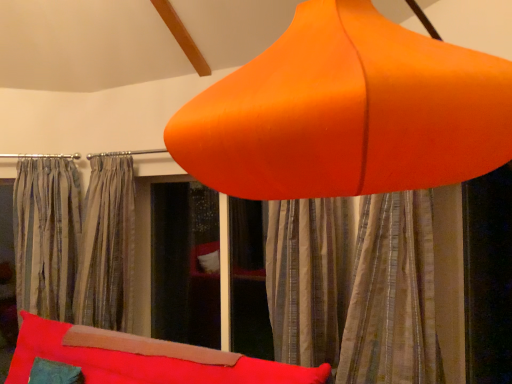
What do you see at coordinates (347, 112) in the screenshot? I see `orange matte lampshade at upper center` at bounding box center [347, 112].

What is the approximate width of striped fabric curtain at center, which ranks as the 1th curtain in front-to-back order?

striped fabric curtain at center, which ranks as the 1th curtain in front-to-back order, is 17.40 inches in width.

Measure the distance between striped fabric curtain at center, the 1th curtain viewed from the right, and camera.

striped fabric curtain at center, the 1th curtain viewed from the right, is 1.77 meters away from camera.

What is the approximate width of velvet red bean bag at lower center?

velvet red bean bag at lower center is 32.22 inches in width.

This screenshot has height=384, width=512. What do you see at coordinates (106, 245) in the screenshot? I see `silky gray curtains at center, which is counted as the second curtain, starting from the front` at bounding box center [106, 245].

At what (x,y) coordinates should I click in order to perform the action: click on orange matte lampshade at upper center. Please return your answer as a coordinate pair (x, y). The width and height of the screenshot is (512, 384). Looking at the image, I should click on (347, 112).

Relative to velvet red bean bag at lower center, is silky gray curtains at center, the 1th curtain in the left-to-right sequence, in front or behind?

Visually, silky gray curtains at center, the 1th curtain in the left-to-right sequence, is located behind velvet red bean bag at lower center.

Does silky gray curtains at center, placed as the 1th curtain when sorted from back to front, have a greater height compared to velvet red bean bag at lower center?

Yes, silky gray curtains at center, placed as the 1th curtain when sorted from back to front, is taller than velvet red bean bag at lower center.

Choose the correct answer: Is orange matte lampshade at upper center inside striped fabric curtain at center, which ranks as the 1th curtain in front-to-back order, or outside it?

orange matte lampshade at upper center cannot be found inside striped fabric curtain at center, which ranks as the 1th curtain in front-to-back order.

Measure the distance from orange matte lampshade at upper center to striped fabric curtain at center, the 1th curtain viewed from the right.

The distance of orange matte lampshade at upper center from striped fabric curtain at center, the 1th curtain viewed from the right, is 1.35 meters.

Is orange matte lampshade at upper center looking in the opposite direction of striped fabric curtain at center, which ranks as the 1th curtain in front-to-back order?

No.

From the image's perspective, which one is positioned lower, orange matte lampshade at upper center or striped fabric curtain at center, which ranks as the 1th curtain in front-to-back order?

striped fabric curtain at center, which ranks as the 1th curtain in front-to-back order, appears lower in the image.

Is point (453, 217) closer to viewer compared to point (125, 336)?

That is True.

Considering the sizes of objects striped fabric curtain at center, marked as the 2th curtain in a back-to-front arrangement, and velvet red bean bag at lower center in the image provided, who is taller, striped fabric curtain at center, marked as the 2th curtain in a back-to-front arrangement, or velvet red bean bag at lower center?

striped fabric curtain at center, marked as the 2th curtain in a back-to-front arrangement.

From the image's perspective, which object appears higher, striped fabric curtain at center, which ranks as the 1th curtain in front-to-back order, or velvet red bean bag at lower center?

striped fabric curtain at center, which ranks as the 1th curtain in front-to-back order, appears higher in the image.

Does striped fabric curtain at center, marked as the 2th curtain in a back-to-front arrangement, have a smaller size compared to velvet red bean bag at lower center?

Correct, striped fabric curtain at center, marked as the 2th curtain in a back-to-front arrangement, occupies less space than velvet red bean bag at lower center.

Considering the relative sizes of velvet red bean bag at lower center and silky gray curtains at center, which is counted as the second curtain, starting from the front, in the image provided, is velvet red bean bag at lower center smaller than silky gray curtains at center, which is counted as the second curtain, starting from the front,?

No, velvet red bean bag at lower center is not smaller than silky gray curtains at center, which is counted as the second curtain, starting from the front.

Is velvet red bean bag at lower center inside the boundaries of silky gray curtains at center, the second curtain when ordered from right to left, or outside?

velvet red bean bag at lower center is spatially situated outside silky gray curtains at center, the second curtain when ordered from right to left.

From the image's perspective, which one is positioned lower, velvet red bean bag at lower center or silky gray curtains at center, the second curtain when ordered from right to left?

velvet red bean bag at lower center is shown below in the image.

Is velvet red bean bag at lower center taller than silky gray curtains at center, the 1th curtain in the left-to-right sequence?

No.

Based on the photo, is striped fabric curtain at center, which ranks as the 1th curtain in front-to-back order, turned away from orange matte lampshade at upper center?

No.

Considering the sizes of striped fabric curtain at center, the second curtain viewed from the left, and orange matte lampshade at upper center in the image, is striped fabric curtain at center, the second curtain viewed from the left, taller or shorter than orange matte lampshade at upper center?

Considering their sizes, striped fabric curtain at center, the second curtain viewed from the left, has less height than orange matte lampshade at upper center.

Would you say orange matte lampshade at upper center is part of striped fabric curtain at center, which ranks as the 1th curtain in front-to-back order,'s contents?

No, orange matte lampshade at upper center is not a part of striped fabric curtain at center, which ranks as the 1th curtain in front-to-back order.

Is point (381, 212) farther from camera compared to point (293, 152)?

Yes, point (381, 212) is farther from viewer.

In the scene shown: Considering the relative sizes of silky gray curtains at center, the second curtain when ordered from right to left, and orange matte lampshade at upper center in the image provided, is silky gray curtains at center, the second curtain when ordered from right to left, smaller than orange matte lampshade at upper center?

Yes, silky gray curtains at center, the second curtain when ordered from right to left, is smaller than orange matte lampshade at upper center.

Locate an element on the screen. The image size is (512, 384). curtain that is the 2nd one when counting backward from the orange matte lampshade at upper center is located at coordinates (106, 245).

Would you say silky gray curtains at center, the second curtain when ordered from right to left, is outside orange matte lampshade at upper center?

That's correct, silky gray curtains at center, the second curtain when ordered from right to left, is outside of orange matte lampshade at upper center.

From a real-world perspective, who is located higher, silky gray curtains at center, the 1th curtain in the left-to-right sequence, or orange matte lampshade at upper center?

orange matte lampshade at upper center.

Considering the sizes of objects velvet red bean bag at lower center and orange matte lampshade at upper center in the image provided, who is bigger, velvet red bean bag at lower center or orange matte lampshade at upper center?

Answer: velvet red bean bag at lower center is bigger.

How many degrees apart are the facing directions of velvet red bean bag at lower center and orange matte lampshade at upper center?

The angle between the facing direction of velvet red bean bag at lower center and the facing direction of orange matte lampshade at upper center is 42.2 degrees.

Where is `bean bag chair to the left of orange matte lampshade at upper center`? The image size is (512, 384). bean bag chair to the left of orange matte lampshade at upper center is located at coordinates (135, 360).

What are the coordinates of `curtain on the left of velvet red bean bag at lower center` in the screenshot? It's located at (106, 245).

Identify the location of lamp in front of the striped fabric curtain at center, which ranks as the 1th curtain in front-to-back order. The height and width of the screenshot is (384, 512). (347, 112).

Estimate the real-world distances between objects in this image. Which object is closer to silky gray curtains at center, the second curtain when ordered from right to left, striped fabric curtain at center, which ranks as the 1th curtain in front-to-back order, or velvet red bean bag at lower center?

velvet red bean bag at lower center is positioned closer to the anchor silky gray curtains at center, the second curtain when ordered from right to left.

Based on their spatial positions, is silky gray curtains at center, the 1th curtain in the left-to-right sequence, or orange matte lampshade at upper center further from velvet red bean bag at lower center?

orange matte lampshade at upper center.

From the image, which object appears to be farther from striped fabric curtain at center, marked as the 2th curtain in a back-to-front arrangement, velvet red bean bag at lower center or silky gray curtains at center, the 1th curtain in the left-to-right sequence?

silky gray curtains at center, the 1th curtain in the left-to-right sequence, is further to striped fabric curtain at center, marked as the 2th curtain in a back-to-front arrangement.

Which object lies further to the anchor point velvet red bean bag at lower center, orange matte lampshade at upper center or striped fabric curtain at center, the second curtain viewed from the left?

Based on the image, orange matte lampshade at upper center appears to be further to velvet red bean bag at lower center.

Which object lies further to the anchor point striped fabric curtain at center, the second curtain viewed from the left, silky gray curtains at center, placed as the 1th curtain when sorted from back to front, or orange matte lampshade at upper center?

Among the two, silky gray curtains at center, placed as the 1th curtain when sorted from back to front, is located further to striped fabric curtain at center, the second curtain viewed from the left.

Estimate the real-world distances between objects in this image. Which object is closer to silky gray curtains at center, which is counted as the second curtain, starting from the front, striped fabric curtain at center, the 1th curtain viewed from the right, or orange matte lampshade at upper center?

striped fabric curtain at center, the 1th curtain viewed from the right, is closer to silky gray curtains at center, which is counted as the second curtain, starting from the front.

Based on their spatial positions, is orange matte lampshade at upper center or velvet red bean bag at lower center further from silky gray curtains at center, the 1th curtain in the left-to-right sequence?

The object further to silky gray curtains at center, the 1th curtain in the left-to-right sequence, is orange matte lampshade at upper center.

Looking at the image, which one is located further to silky gray curtains at center, placed as the 1th curtain when sorted from back to front, velvet red bean bag at lower center or orange matte lampshade at upper center?

The object further to silky gray curtains at center, placed as the 1th curtain when sorted from back to front, is orange matte lampshade at upper center.

You are a GUI agent. You are given a task and a screenshot of the screen. Output one action in this format:
    pyautogui.click(x=<x>, y=<y>)
    Task: Click on the bean bag chair between orange matte lampshade at upper center and silky gray curtains at center, the 1th curtain in the left-to-right sequence, in the front-back direction
    The height and width of the screenshot is (384, 512).
    Given the screenshot: What is the action you would take?
    pyautogui.click(x=135, y=360)

I want to click on lamp located between velvet red bean bag at lower center and striped fabric curtain at center, the second curtain viewed from the left, in the left-right direction, so click(x=347, y=112).

This screenshot has height=384, width=512. What are the coordinates of `curtain located between orange matte lampshade at upper center and silky gray curtains at center, placed as the 1th curtain when sorted from back to front, in the depth direction` in the screenshot? It's located at point(369,285).

In order to click on bean bag chair located between silky gray curtains at center, the 1th curtain in the left-to-right sequence, and striped fabric curtain at center, marked as the 2th curtain in a back-to-front arrangement, in the left-right direction in this screenshot , I will do `click(135, 360)`.